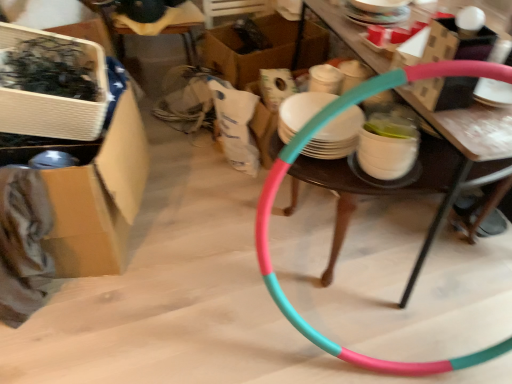
Describe the element at coordinates (250, 50) in the screenshot. I see `cardboard box at center, the third box viewed from the front` at that location.

What do you see at coordinates (344, 110) in the screenshot?
I see `pink rubber hula hoop at center` at bounding box center [344, 110].

Image resolution: width=512 pixels, height=384 pixels. Describe the element at coordinates (52, 97) in the screenshot. I see `white cardboard box at upper left, marked as the 1th box in a front-to-back arrangement` at that location.

You are a GUI agent. You are given a task and a screenshot of the screen. Output one action in this format:
    pyautogui.click(x=<x>, y=<y>)
    Task: Click on the cardboard box at center, the 1th box viewed from the back
    The width and height of the screenshot is (512, 384).
    Given the screenshot: What is the action you would take?
    250,50

Is teal plastic hoop at center directly adjacent to white cardboard box at upper left, marked as the 1th box in a front-to-back arrangement?

No, teal plastic hoop at center is not next to white cardboard box at upper left, marked as the 1th box in a front-to-back arrangement.

From the image's perspective, is teal plastic hoop at center located beneath white cardboard box at upper left, marked as the 1th box in a front-to-back arrangement?

Indeed, from the image's perspective, teal plastic hoop at center is shown beneath white cardboard box at upper left, marked as the 1th box in a front-to-back arrangement.

Could white cardboard box at upper left, which is the third box in back-to-front order, be considered to be inside teal plastic hoop at center?

Definitely not — white cardboard box at upper left, which is the third box in back-to-front order, is not inside teal plastic hoop at center.

From a real-world perspective, is teal plastic hoop at center positioned over white cardboard box at upper left, marked as the 1th box in a front-to-back arrangement, based on gravity?

No, from a real-world perspective, teal plastic hoop at center is not above white cardboard box at upper left, marked as the 1th box in a front-to-back arrangement.

Consider the image. Is white cardboard box at upper left, which is the third box in back-to-front order, oriented away from cardboard box at center, the 1th box viewed from the back?

That's not correct — white cardboard box at upper left, which is the third box in back-to-front order, is not looking away from cardboard box at center, the 1th box viewed from the back.

Does white cardboard box at upper left, which is the third box in back-to-front order, have a smaller size compared to cardboard box at center, the third box viewed from the front?

Yes.

Which is more to the left, white cardboard box at upper left, which is the third box in back-to-front order, or cardboard box at center, the 1th box viewed from the back?

Positioned to the left is white cardboard box at upper left, which is the third box in back-to-front order.

From the image's perspective, is white cardboard box at upper left, which is the third box in back-to-front order, located beneath cardboard box at center, the 1th box viewed from the back?

Indeed, from the image's perspective, white cardboard box at upper left, which is the third box in back-to-front order, is shown beneath cardboard box at center, the 1th box viewed from the back.

Based on the photo, from the image's perspective, between cardboard box at left, which is counted as the second box, starting from the back, and pink rubber hula hoop at center, which one is located above?

cardboard box at left, which is counted as the second box, starting from the back, from the image's perspective.

Does point (45, 246) lie in front of point (269, 177)?

That is True.

From a real-world perspective, starting from the pink rubber hula hoop at center, which box is the 1st one vertically above it? Please provide its 2D coordinates.

[(100, 197)]

Consider the image. Considering the sizes of objects cardboard box at left, which is the 2th box in front-to-back order, and pink rubber hula hoop at center in the image provided, who is thinner, cardboard box at left, which is the 2th box in front-to-back order, or pink rubber hula hoop at center?

pink rubber hula hoop at center.

Is wooden chair at upper center not within teal plastic hoop at center?

Yes, wooden chair at upper center is located beyond the bounds of teal plastic hoop at center.

Which of these two, wooden chair at upper center or teal plastic hoop at center, stands taller?

wooden chair at upper center is taller.

Considering the relative sizes of wooden chair at upper center and teal plastic hoop at center in the image provided, is wooden chair at upper center wider than teal plastic hoop at center?

Yes, wooden chair at upper center is wider than teal plastic hoop at center.

Is wooden chair at upper center aimed at teal plastic hoop at center?

Yes, wooden chair at upper center faces towards teal plastic hoop at center.

Is cardboard box at center, the 1th box viewed from the back, completely or partially outside of pink rubber hula hoop at center?

Yes, cardboard box at center, the 1th box viewed from the back, is outside of pink rubber hula hoop at center.

Based on the photo, is cardboard box at center, the 1th box viewed from the back, thinner than pink rubber hula hoop at center?

Correct, the width of cardboard box at center, the 1th box viewed from the back, is less than that of pink rubber hula hoop at center.

Is cardboard box at center, the third box viewed from the front, facing away from pink rubber hula hoop at center?

cardboard box at center, the third box viewed from the front, is not turned away from pink rubber hula hoop at center.

Considering the relative positions of cardboard box at center, the third box viewed from the front, and pink rubber hula hoop at center in the image provided, is cardboard box at center, the third box viewed from the front, to the left of pink rubber hula hoop at center from the viewer's perspective?

Indeed, cardboard box at center, the third box viewed from the front, is positioned on the left side of pink rubber hula hoop at center.

From a real-world perspective, is cardboard box at left, which is the 2th box in front-to-back order, positioned above or below white cardboard box at upper left, marked as the 1th box in a front-to-back arrangement?

In terms of real-world spatial position, cardboard box at left, which is the 2th box in front-to-back order, is below white cardboard box at upper left, marked as the 1th box in a front-to-back arrangement.

How different are the orientations of cardboard box at left, which is the 2th box in front-to-back order, and white cardboard box at upper left, marked as the 1th box in a front-to-back arrangement, in degrees?

11.9 degrees separate the facing orientations of cardboard box at left, which is the 2th box in front-to-back order, and white cardboard box at upper left, marked as the 1th box in a front-to-back arrangement.

Would you say cardboard box at left, which is counted as the second box, starting from the back, is outside white cardboard box at upper left, marked as the 1th box in a front-to-back arrangement?

Yes.

Does point (77, 205) appear closer or farther from the camera than point (97, 122)?

Point (77, 205) appears to be farther away from the viewer than point (97, 122).

Where is `table behind the white cardboard box at upper left, which is the third box in back-to-front order`? This screenshot has width=512, height=384. table behind the white cardboard box at upper left, which is the third box in back-to-front order is located at coordinates (344, 110).

Can you confirm if pink rubber hula hoop at center is thinner than white cardboard box at upper left, which is the third box in back-to-front order?

No, pink rubber hula hoop at center is not thinner than white cardboard box at upper left, which is the third box in back-to-front order.

Is point (324, 121) less distant than point (36, 129)?

Yes, point (324, 121) is closer to viewer.

From the picture: From the image's perspective, is pink rubber hula hoop at center above or below white cardboard box at upper left, marked as the 1th box in a front-to-back arrangement?

pink rubber hula hoop at center is situated lower than white cardboard box at upper left, marked as the 1th box in a front-to-back arrangement, in the image.

Image resolution: width=512 pixels, height=384 pixels. In order to click on box that is the 1st object located above the teal plastic hoop at center (from the image's perspective) in this screenshot , I will do `click(52, 97)`.

This screenshot has height=384, width=512. I want to click on box that is the 2nd one above the cardboard box at center, the 1th box viewed from the back (from a real-world perspective), so click(52, 97).

Estimate the real-world distances between objects in this image. Which object is closer to cardboard box at left, which is the 2th box in front-to-back order, pink rubber hula hoop at center or teal plastic hoop at center?

pink rubber hula hoop at center lies closer to cardboard box at left, which is the 2th box in front-to-back order, than the other object.

Looking at the image, which one is located further to white cardboard box at upper left, marked as the 1th box in a front-to-back arrangement, pink rubber hula hoop at center or cardboard box at left, which is the 2th box in front-to-back order?

The object further to white cardboard box at upper left, marked as the 1th box in a front-to-back arrangement, is pink rubber hula hoop at center.

Looking at this image, considering their positions, is teal plastic hoop at center positioned further to white cardboard box at upper left, marked as the 1th box in a front-to-back arrangement, than pink rubber hula hoop at center?

The object further to white cardboard box at upper left, marked as the 1th box in a front-to-back arrangement, is teal plastic hoop at center.

When comparing their distances from white cardboard box at upper left, which is the third box in back-to-front order, does pink rubber hula hoop at center or teal plastic hoop at center seem closer?

Among the two, pink rubber hula hoop at center is located nearer to white cardboard box at upper left, which is the third box in back-to-front order.

Looking at the image, which one is located closer to teal plastic hoop at center, cardboard box at left, which is counted as the second box, starting from the back, or wooden chair at upper center?

cardboard box at left, which is counted as the second box, starting from the back.

From the image, which object appears to be farther from wooden chair at upper center, cardboard box at left, which is the 2th box in front-to-back order, or cardboard box at center, the third box viewed from the front?

cardboard box at left, which is the 2th box in front-to-back order.

When comparing their distances from wooden chair at upper center, does teal plastic hoop at center or cardboard box at left, which is the 2th box in front-to-back order, seem further?

Based on the image, teal plastic hoop at center appears to be further to wooden chair at upper center.

Estimate the real-world distances between objects in this image. Which object is further from cardboard box at center, the 1th box viewed from the back, pink rubber hula hoop at center or white cardboard box at upper left, which is the third box in back-to-front order?

Based on the image, pink rubber hula hoop at center appears to be further to cardboard box at center, the 1th box viewed from the back.

Identify the location of box situated between white cardboard box at upper left, which is the third box in back-to-front order, and pink rubber hula hoop at center from left to right. (250, 50).

Where is `chair located between cardboard box at left, which is the 2th box in front-to-back order, and cardboard box at center, the 1th box viewed from the back, in the depth direction`? chair located between cardboard box at left, which is the 2th box in front-to-back order, and cardboard box at center, the 1th box viewed from the back, in the depth direction is located at coordinates (111, 24).

This screenshot has height=384, width=512. Find the location of `chair located between white cardboard box at upper left, marked as the 1th box in a front-to-back arrangement, and teal plastic hoop at center in the left-right direction`. chair located between white cardboard box at upper left, marked as the 1th box in a front-to-back arrangement, and teal plastic hoop at center in the left-right direction is located at coordinates (111, 24).

Locate an element on the screen. The width and height of the screenshot is (512, 384). chair situated between cardboard box at left, which is the 2th box in front-to-back order, and teal plastic hoop at center from left to right is located at coordinates (111, 24).